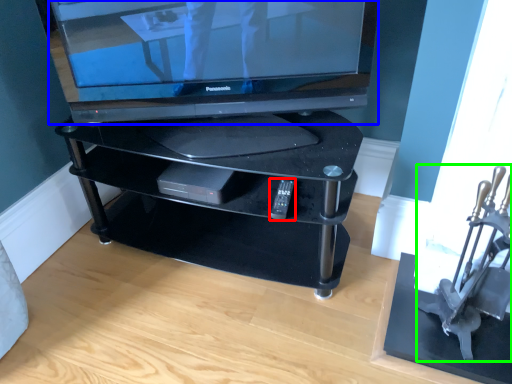
Question: Which object is positioned closest to remote (highlighted by a red box)? Select from television (highlighted by a blue box) and armchair (highlighted by a green box).

Choices:
 (A) television
 (B) armchair

Answer: (A)